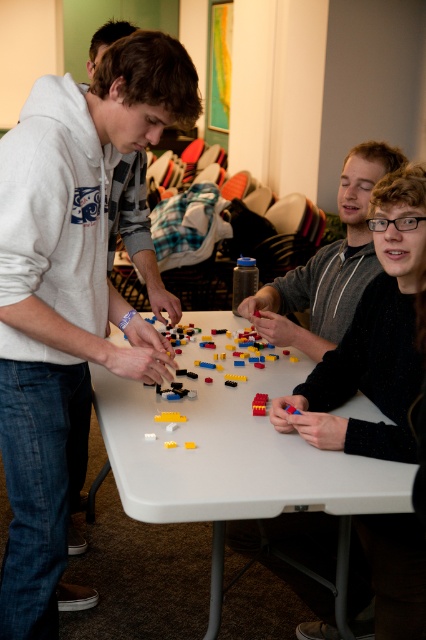
You are standing in front of the white folding table where the group is working. Which direction should you look to see the matte gray hoodie at left?

The matte gray hoodie at left is located at point 0.455 on the x axis and 0.174 on the y axis, so you should look to the left side of the table to see it.

You are a person who is 1.7 meters tall. You are standing in front of the white plastic table at center and the matte gray sweater at center. Which object is taller?

The matte gray sweater at center is taller than the white plastic table at center.